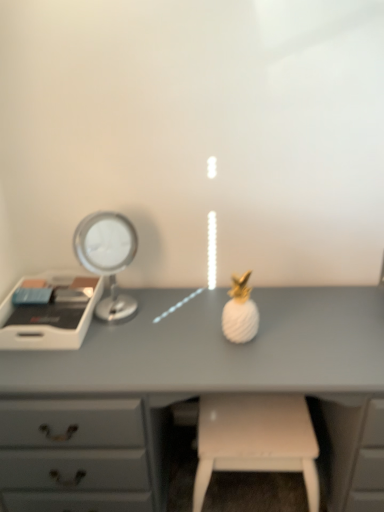
Question: Is the position of silver metallic mirror at left more distant than that of white plastic tray at left?

Choices:
 (A) no
 (B) yes

Answer: (A)

Question: From a real-world perspective, is silver metallic mirror at left positioned under white plastic tray at left based on gravity?

Choices:
 (A) yes
 (B) no

Answer: (B)

Question: Is silver metallic mirror at left shorter than white plastic tray at left?

Choices:
 (A) yes
 (B) no

Answer: (B)

Question: Can you confirm if silver metallic mirror at left is positioned to the left of white plastic tray at left?

Choices:
 (A) yes
 (B) no

Answer: (B)

Question: Is silver metallic mirror at left outside of white plastic tray at left?

Choices:
 (A) yes
 (B) no

Answer: (A)

Question: Can you confirm if silver metallic mirror at left is smaller than white plastic tray at left?

Choices:
 (A) yes
 (B) no

Answer: (B)

Question: Does white plastic tray at left have a greater height compared to silver metallic mirror at left?

Choices:
 (A) yes
 (B) no

Answer: (B)

Question: Is white plastic tray at left not close to silver metallic mirror at left?

Choices:
 (A) no
 (B) yes

Answer: (A)

Question: Is white plastic tray at left looking in the opposite direction of silver metallic mirror at left?

Choices:
 (A) no
 (B) yes

Answer: (A)

Question: Does white plastic tray at left lie behind silver metallic mirror at left?

Choices:
 (A) no
 (B) yes

Answer: (B)

Question: Is white plastic tray at left smaller than silver metallic mirror at left?

Choices:
 (A) yes
 (B) no

Answer: (A)

Question: Could silver metallic mirror at left be considered to be inside white plastic tray at left?

Choices:
 (A) no
 (B) yes

Answer: (A)

Question: Is silver metallic mirror at left to the left of white matte stool at lower center from the viewer's perspective?

Choices:
 (A) no
 (B) yes

Answer: (B)